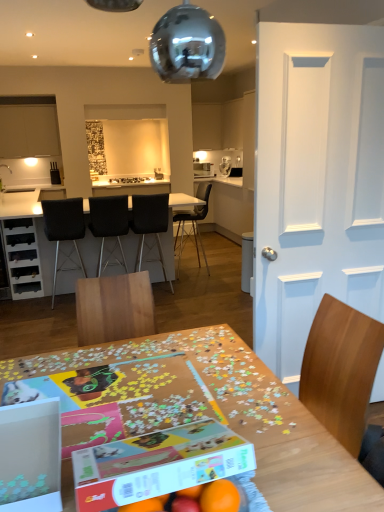
Question: Is matte white cabinet at upper left taller or shorter than white painted wood door at right?

Choices:
 (A) short
 (B) tall

Answer: (A)

Question: In terms of width, does matte white cabinet at upper left look wider or thinner when compared to white painted wood door at right?

Choices:
 (A) wide
 (B) thin

Answer: (A)

Question: Which is farther from the black matte chair at center, which is the 1th chair in right-to-left order?

Choices:
 (A) black mesh chair at center, which appears as the 4th chair when viewed from the right
 (B) orange matte at lower center
 (C) black leather chair at center, positioned as the second chair in right-to-left order
 (D) white cardboard box at center, which is the 1th cardboard box in right-to-left order
 (E) wooden puzzle table at center, the first table ordered from the bottom

Answer: (B)

Question: Estimate the real-world distances between objects in this image. Which object is farther from the black matte chair at center, which is the 1th chair in right-to-left order?

Choices:
 (A) black leather chair at center, positioned as the second chair in right-to-left order
 (B) white cardboard box at center, placed as the 2th cardboard box when sorted from left to right
 (C) wooden puzzle table at center, the first table ordered from the bottom
 (D) white painted wood door at right
 (E) matte white cabinet at upper left

Answer: (B)